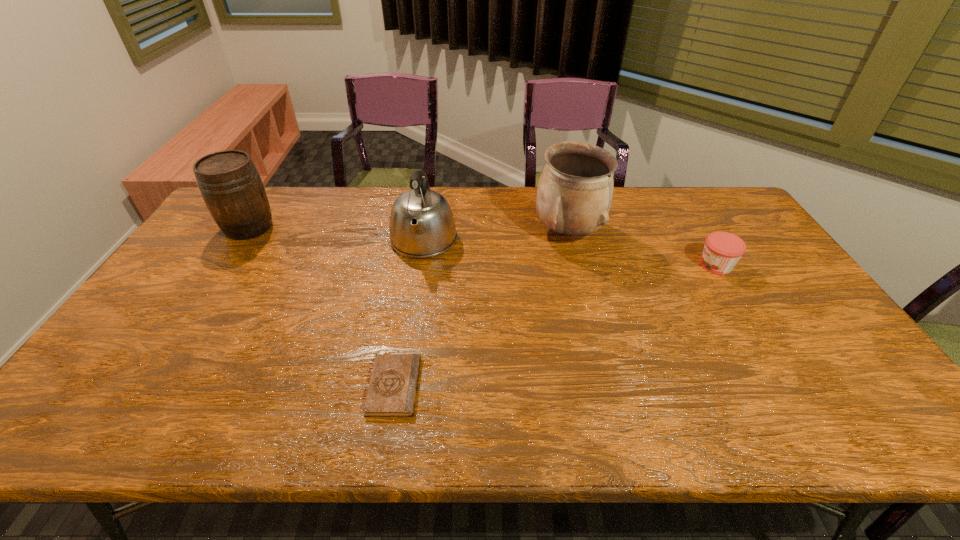
The height and width of the screenshot is (540, 960). I want to click on vacant space located on the front label of the rightmost object, so click(x=682, y=266).

Identify the location of vacant space situated on the front label of the rightmost object. The height and width of the screenshot is (540, 960). (648, 266).

Where is `free space located 0.300m on the front label of the rightmost object`? The image size is (960, 540). free space located 0.300m on the front label of the rightmost object is located at coordinates (599, 266).

This screenshot has width=960, height=540. In order to click on free space located 0.160m on the spine side of the nearest object in this screenshot , I will do [487, 386].

You are a GUI agent. You are given a task and a screenshot of the screen. Output one action in this format:
    pyautogui.click(x=<x>, y=<y>)
    Task: Click on the urn that is at the far edge
    
    Given the screenshot: What is the action you would take?
    pyautogui.click(x=575, y=190)

Where is `kettle located in the far edge section of the desktop`? The height and width of the screenshot is (540, 960). kettle located in the far edge section of the desktop is located at coordinates (422, 225).

You are a GUI agent. You are given a task and a screenshot of the screen. Output one action in this format:
    pyautogui.click(x=<x>, y=<y>)
    Task: Click on the cider present at the far edge
    
    Given the screenshot: What is the action you would take?
    pyautogui.click(x=230, y=185)

Identify the location of object that is at the near edge. tap(392, 391).

At what (x,y) coordinates should I click in order to perform the action: click on object at the left edge. Please return your answer as a coordinate pair (x, y). Looking at the image, I should click on (230, 185).

Where is `object that is at the right edge`? Image resolution: width=960 pixels, height=540 pixels. object that is at the right edge is located at coordinates (722, 250).